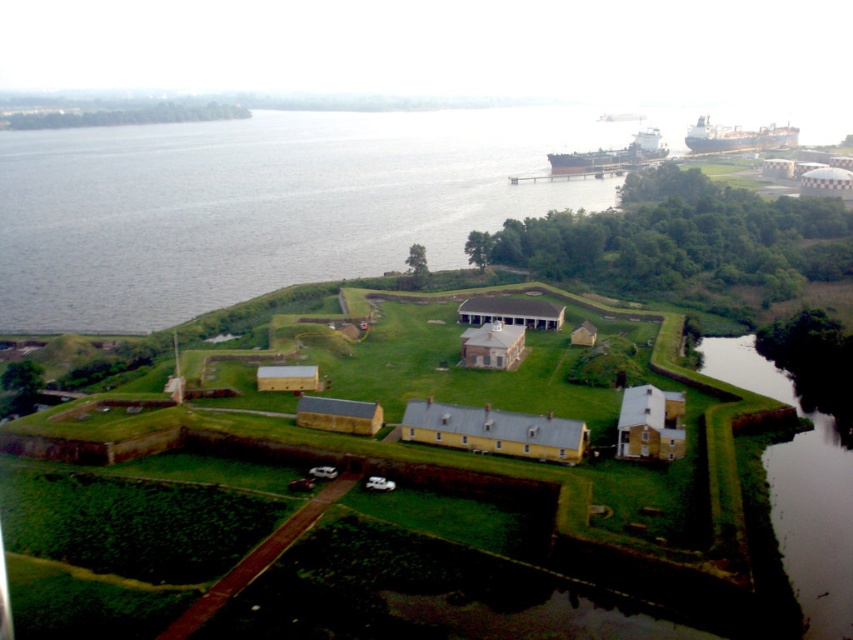
You are a visitor standing at the entrance of the fort and want to take a photo of the gray water at upper left and the green grassy embankment at lower right. Which object should you frame first in your camera viewfinder to ensure both are captured in the same shot?

You should frame the gray water at upper left first because it is positioned on the left side of the green grassy embankment at lower right, so capturing the left side first will include both objects in the frame.

You are standing at the entrance of the historical fortification and see the point marked at coordinates (801, 486). What does this point represent in the scene?

The point at coordinates (801, 486) corresponds to the green grassy embankment at lower right.